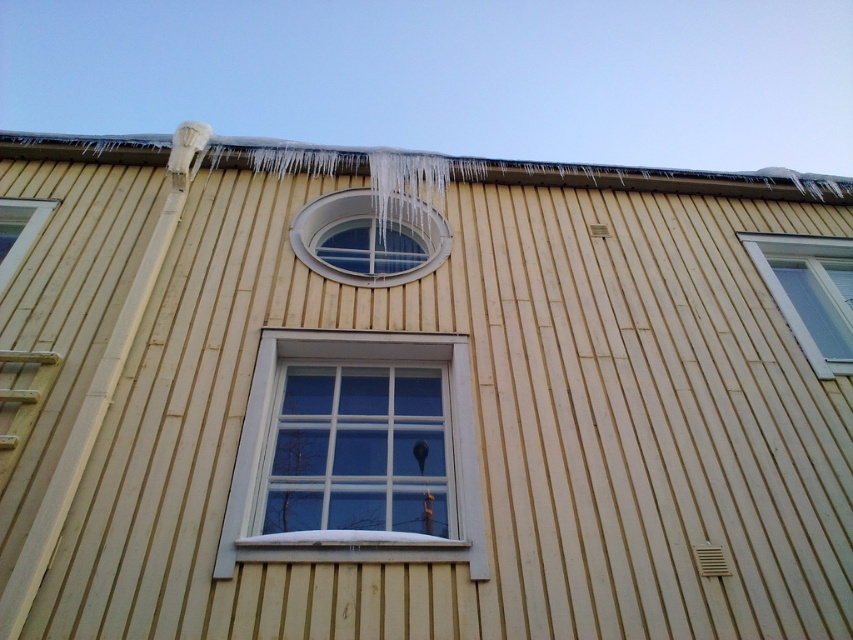
You are standing in front of the building and want to locate the clear glass window at center and the clear glass window at upper left. Which window is located to the right of the other?

The clear glass window at center is positioned on the right side of clear glass window at upper left, so the clear glass window at center is to the right of the clear glass window at upper left.

You are standing in front of the building and see two points marked on the image. Which point is closer to you, point [369,248] or point [4,266]?

Point [369,248] is further to the viewer than point [4,266], so the closer point to you is point [4,266].